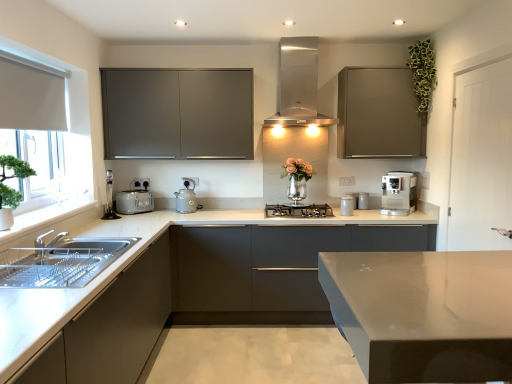
Question: Considering their positions, is white marble countertop at lower left, the sixth cabinetry positioned from the top, located in front of or behind satin silver coffee machine at right, the 2th home appliance when ordered from top to bottom?

Choices:
 (A) front
 (B) behind

Answer: (A)

Question: Looking at the image, does white marble countertop at lower left, positioned as the first cabinetry in bottom-to-top order, seem bigger or smaller compared to satin silver coffee machine at right, the 2th home appliance when ordered from top to bottom?

Choices:
 (A) small
 (B) big

Answer: (B)

Question: Based on their relative distances, which object is nearer to the black glass cooktop at center, the first home appliance positioned from the bottom?

Choices:
 (A) matte gray cabinets at center, the 3th cabinetry from the bottom
 (B) matte gray cabinet at center, marked as the second cabinetry in a bottom-to-top arrangement
 (C) green leafy plant at upper right
 (D) white wood door at right
 (E) stainless steel range hood at center, arranged as the 3th home appliance when ordered from the bottom

Answer: (A)

Question: Based on their relative distances, which object is farther from the matte gray cabinets at center, which appears as the fourth cabinetry when viewed from the top?

Choices:
 (A) satin silver coffee machine at right, which appears as the second home appliance when ordered from the bottom
 (B) matte gray cabinet at center, marked as the second cabinetry in a bottom-to-top arrangement
 (C) white fabric at left
 (D) white marble countertop at lower left, the sixth cabinetry positioned from the top
 (E) matte gray cabinet at upper right, which is the 6th cabinetry in bottom-to-top order

Answer: (C)